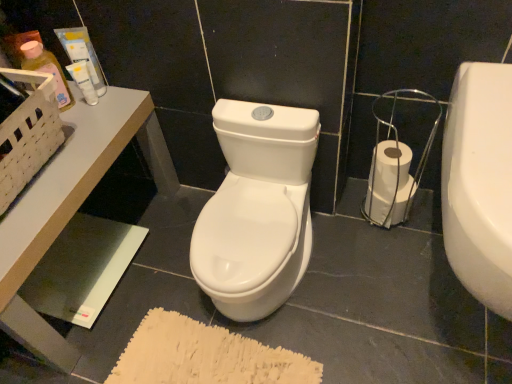
Question: Is white glossy table at upper left looking in the opposite direction of translucent plastic bottle at upper left, which appears as the 1th toiletry when viewed from the left?

Choices:
 (A) yes
 (B) no

Answer: (B)

Question: Can you confirm if white glossy table at upper left is thinner than translucent plastic bottle at upper left, acting as the third toiletry starting from the right?

Choices:
 (A) no
 (B) yes

Answer: (A)

Question: Considering the relative positions of white glossy table at upper left and translucent plastic bottle at upper left, acting as the third toiletry starting from the right, in the image provided, is white glossy table at upper left behind translucent plastic bottle at upper left, acting as the third toiletry starting from the right,?

Choices:
 (A) no
 (B) yes

Answer: (A)

Question: Is white glossy table at upper left positioned before translucent plastic bottle at upper left, which appears as the 1th toiletry when viewed from the left?

Choices:
 (A) yes
 (B) no

Answer: (A)

Question: Is white glossy table at upper left oriented towards translucent plastic bottle at upper left, which appears as the 1th toiletry when viewed from the left?

Choices:
 (A) no
 (B) yes

Answer: (A)

Question: Is matte plastic tube at upper left, the second toiletry when ordered from right to left, bigger or smaller than white glossy table at upper left?

Choices:
 (A) big
 (B) small

Answer: (B)

Question: From a real-world perspective, is matte plastic tube at upper left, the second toiletry when ordered from right to left, above or below white glossy table at upper left?

Choices:
 (A) above
 (B) below

Answer: (A)

Question: Choose the correct answer: Is matte plastic tube at upper left, which ranks as the second toiletry in left-to-right order, inside white glossy table at upper left or outside it?

Choices:
 (A) outside
 (B) inside

Answer: (A)

Question: Is point (93, 81) closer or farther from the camera than point (53, 344)?

Choices:
 (A) closer
 (B) farther

Answer: (B)

Question: Choose the correct answer: Is white glossy table at upper left inside white matte tube at upper left, arranged as the first toiletry when viewed from the right, or outside it?

Choices:
 (A) inside
 (B) outside

Answer: (B)

Question: Based on their positions, is white glossy table at upper left located to the left or right of white matte tube at upper left, arranged as the 3th toiletry when viewed from the left?

Choices:
 (A) left
 (B) right

Answer: (A)

Question: Considering their positions, is white glossy table at upper left located in front of or behind white matte tube at upper left, arranged as the 3th toiletry when viewed from the left?

Choices:
 (A) behind
 (B) front

Answer: (B)

Question: Looking at their shapes, would you say white glossy table at upper left is wider or thinner than white matte tube at upper left, arranged as the 3th toiletry when viewed from the left?

Choices:
 (A) wide
 (B) thin

Answer: (A)

Question: Is translucent plastic bottle at upper left, which appears as the 1th toiletry when viewed from the left, bigger or smaller than white glossy toilet paper at lower right?

Choices:
 (A) small
 (B) big

Answer: (A)

Question: Is translucent plastic bottle at upper left, acting as the third toiletry starting from the right, inside or outside of white glossy toilet paper at lower right?

Choices:
 (A) outside
 (B) inside

Answer: (A)